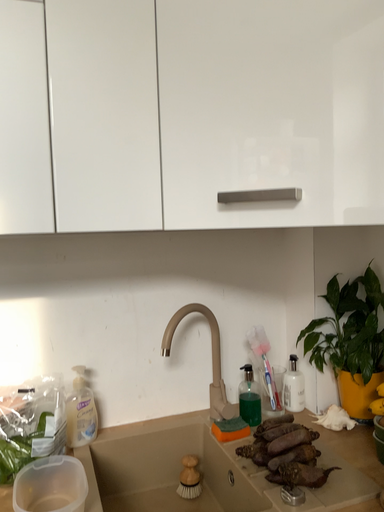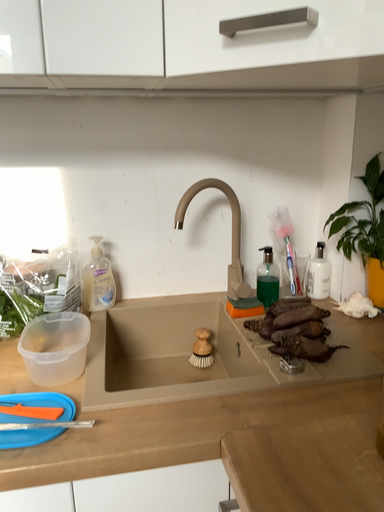
Question: How did the camera likely rotate when shooting the video?

Choices:
 (A) rotated downward
 (B) rotated upward

Answer: (A)